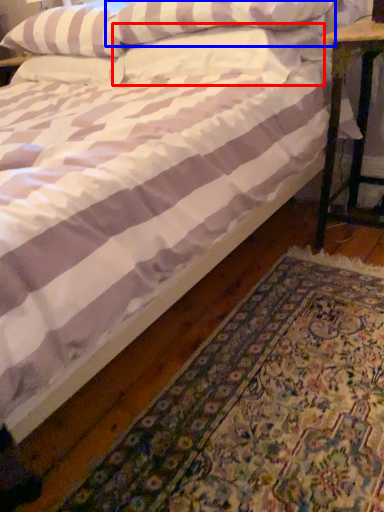
Question: Which of the following is the farthest to the observer, pillow (highlighted by a red box) or pillow (highlighted by a blue box)?

Choices:
 (A) pillow
 (B) pillow

Answer: (A)